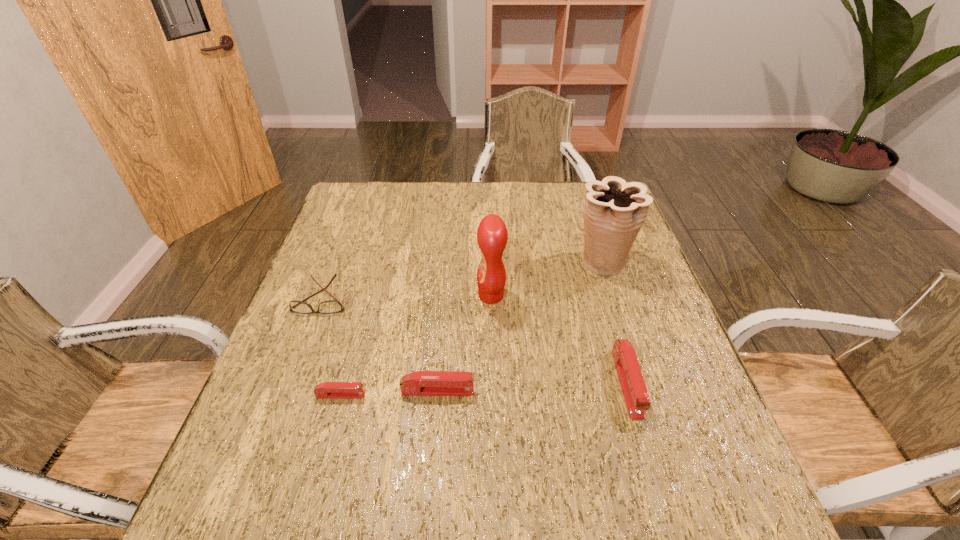
This screenshot has width=960, height=540. What are the coordinates of `vacant area located on the label side of the third object from right to left` in the screenshot? It's located at [387, 295].

You are a GUI agent. You are given a task and a screenshot of the screen. Output one action in this format:
    pyautogui.click(x=<x>, y=<y>)
    Task: Click on the vacant space located 0.180m on the label side of the third object from right to left
    This screenshot has height=540, width=960.
    Given the screenshot: What is the action you would take?
    pyautogui.click(x=406, y=295)

Identify the location of vacant space located 0.260m on the label side of the third object from right to left. The image size is (960, 540). (375, 295).

Identify the location of vacant space located on the left of the urn. The height and width of the screenshot is (540, 960). coord(447,262).

Locate an element on the screen. The image size is (960, 540). vacant region located on the front-facing side of the spectacles is located at coordinates (310, 330).

Where is `stapler at the left edge`? The image size is (960, 540). stapler at the left edge is located at coordinates (328, 390).

You are a GUI agent. You are given a task and a screenshot of the screen. Output one action in this format:
    pyautogui.click(x=<x>, y=<y>)
    Task: Click on the spectacles at the left edge
    Image resolution: width=960 pixels, height=540 pixels.
    Given the screenshot: What is the action you would take?
    pyautogui.click(x=331, y=306)

Where is `stapler present at the right edge`? The width and height of the screenshot is (960, 540). stapler present at the right edge is located at coordinates (634, 390).

You are a GUI agent. You are given a task and a screenshot of the screen. Output one action in this format:
    pyautogui.click(x=<x>, y=<y>)
    Task: Click on the urn present at the right edge
    
    Given the screenshot: What is the action you would take?
    pyautogui.click(x=614, y=212)

In order to click on free space at the far edge in this screenshot , I will do `click(544, 197)`.